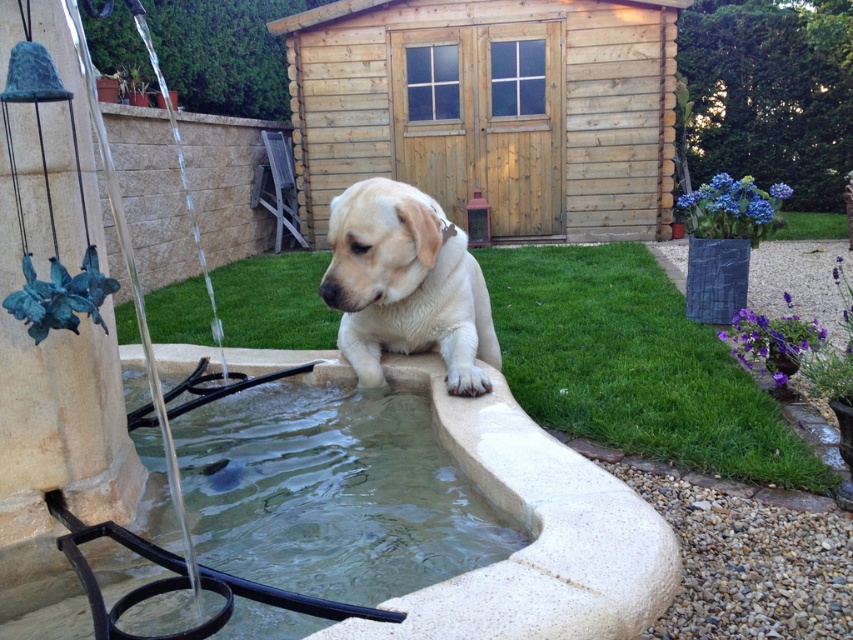
You are trying to decide whether to place a small potted plant between the wooden shed at center and the light beige fur at center. Based on their heights, which object should the plant be placed closer to in order to avoid blocking the view of the taller object?

The wooden shed at center is taller than the light beige fur at center. To avoid blocking the view of the taller object, the plant should be placed closer to the light beige fur at center.

From the picture: You are standing at the origin point in the backyard scene. The wooden shed at center is located at point (491, 109). Can you determine the direction you need to walk to reach the wooden shed at center from your current position?

The wooden shed at center is located at point (491, 109). Since you are at the origin point, you need to move towards the coordinates provided to reach it.

You are planning to place a new bench in the backyard. The bench is 1.2 meters wide. You want to place it between the wooden shed at center and the clear glass water at lower center. Can the bench fit in the space between them without overlapping either object?

The wooden shed at center is wider than the clear glass water at lower center. However, the description does not provide the exact distance between them. Therefore, it is impossible to determine if the bench will fit without additional information about the space between the two objects.